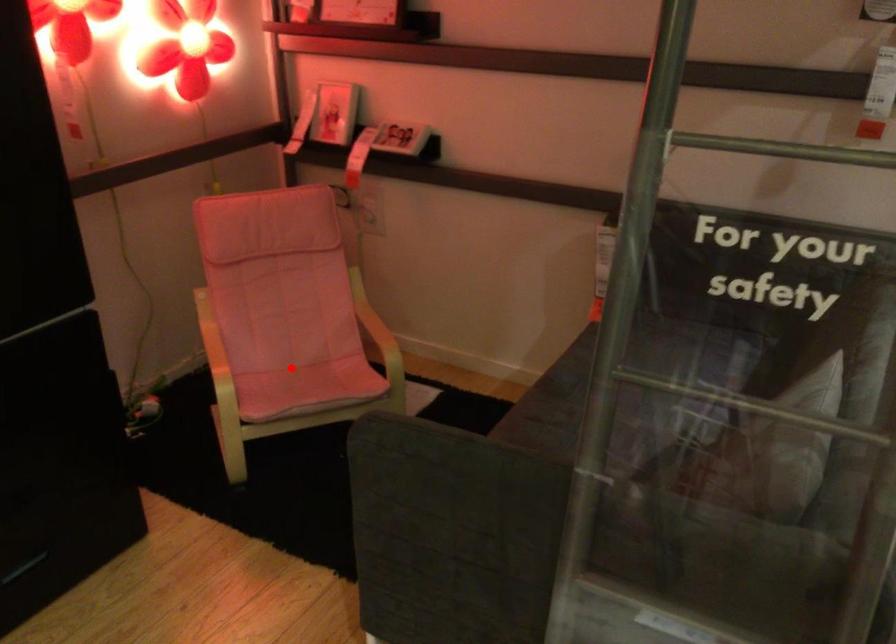
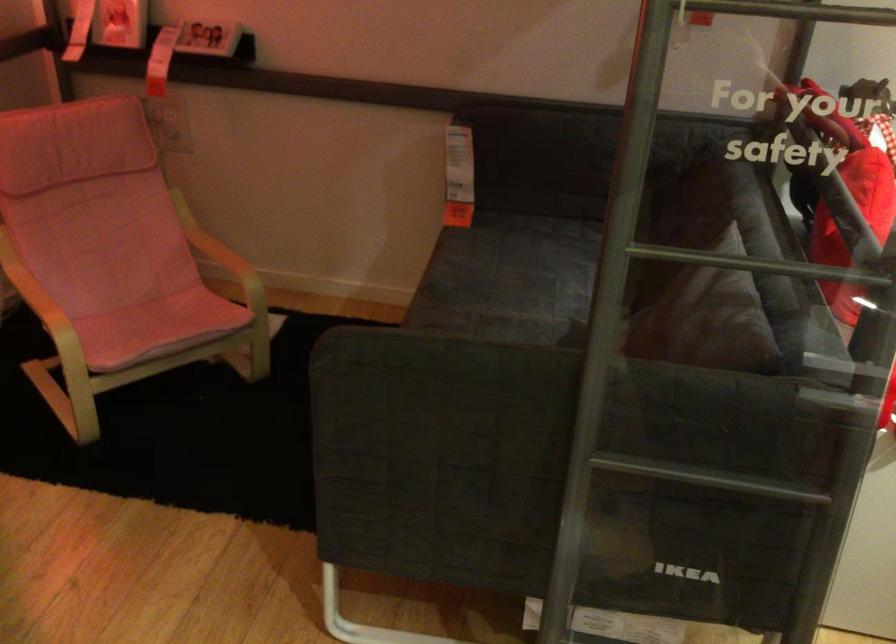
Question: I am providing you with two images of the same scene from different viewpoints. Given a red point in image1, look at the same physical point in image2. Is it:

Choices:
 (A) Closer to the viewpoint
 (B) Farther from the viewpoint

Answer: (A)